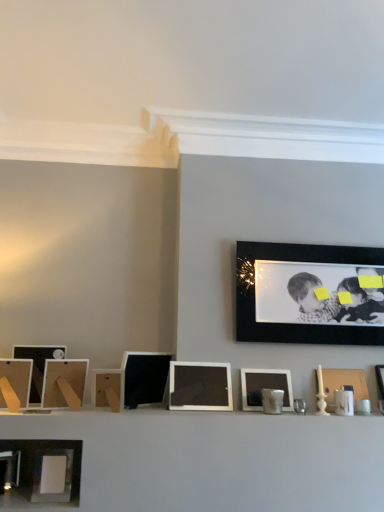
Question: In terms of height, does matte white picture frame at center, the third picture frame from the right, look taller or shorter compared to matte black picture frame at left, positioned as the first picture frame in left-to-right order?

Choices:
 (A) tall
 (B) short

Answer: (B)

Question: Is matte white picture frame at center, the 7th picture frame from the left, wider or thinner than matte black picture frame at left, which is the 9th picture frame from right to left?

Choices:
 (A) wide
 (B) thin

Answer: (B)

Question: Which is nearer to the wooden picture frame at right, the first picture frame from the right?

Choices:
 (A) matte black picture frame at left, acting as the eighth picture frame starting from the right
 (B) matte white picture frame at center, the third picture frame from the right
 (C) matte black picture frame at left, which is the 9th picture frame from right to left
 (D) matte wooden picture frame at left, which is the 7th picture frame from right to left
 (E) matte black picture frame at center, which appears as the 4th picture frame when viewed from the right

Answer: (B)

Question: Which object is positioned closest to the matte black picture frame at left, acting as the eighth picture frame starting from the right?

Choices:
 (A) wooden picture frame at right, the first picture frame from the right
 (B) matte black picture frame at left, which is the 9th picture frame from right to left
 (C) matte white picture frame at center, the 7th picture frame from the left
 (D) matte black picture frame at center, placed as the 5th picture frame when sorted from left to right
 (E) black matte picture frame at upper right, the 2th picture frame from the right

Answer: (B)